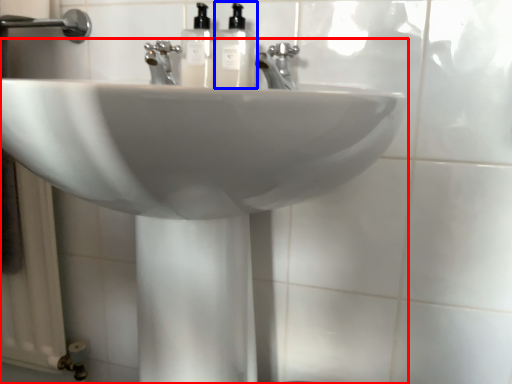
Question: Which of the following is the closest to the observer, sink (highlighted by a red box) or soap dispenser (highlighted by a blue box)?

Choices:
 (A) sink
 (B) soap dispenser

Answer: (A)